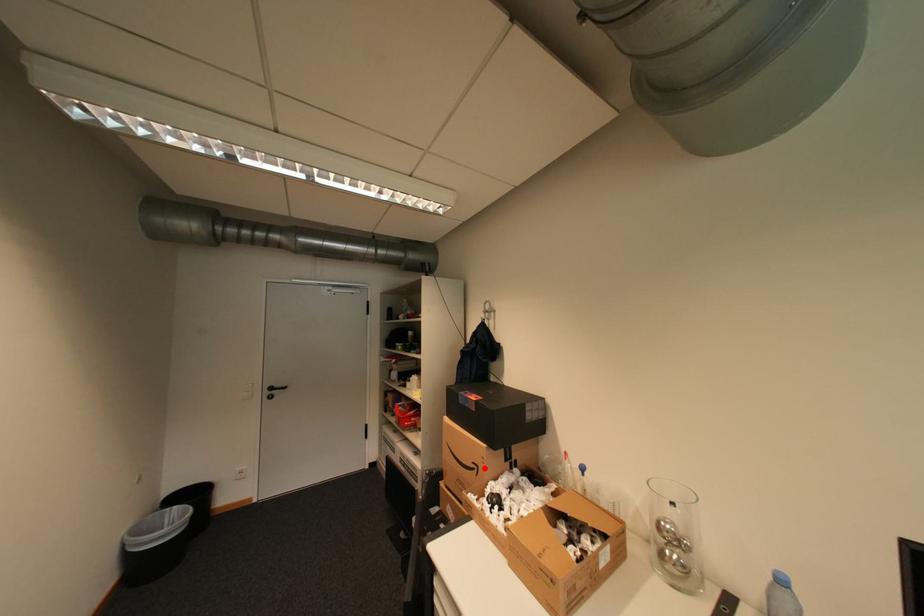
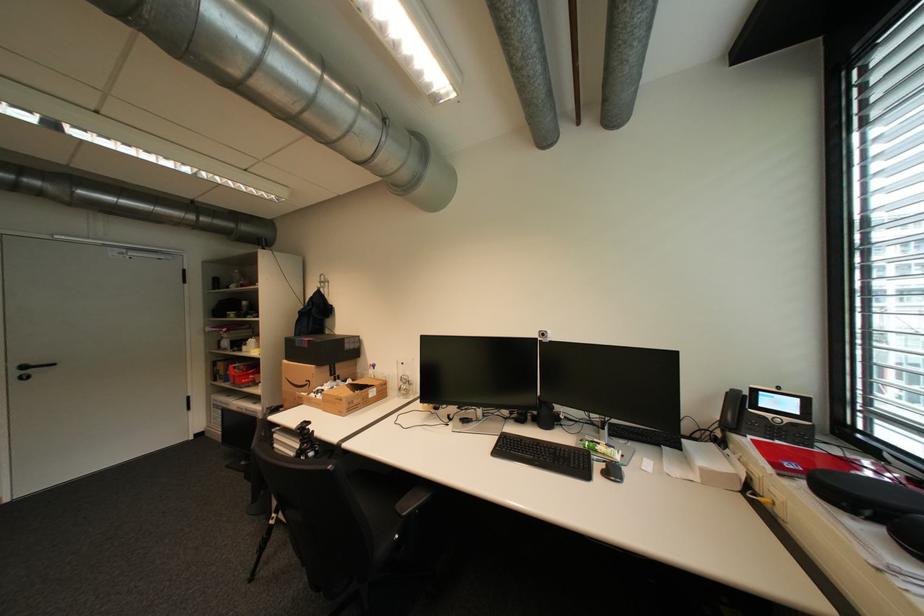
In the second image, find the point that corresponds to the highlighted location in the first image.

(317, 383)